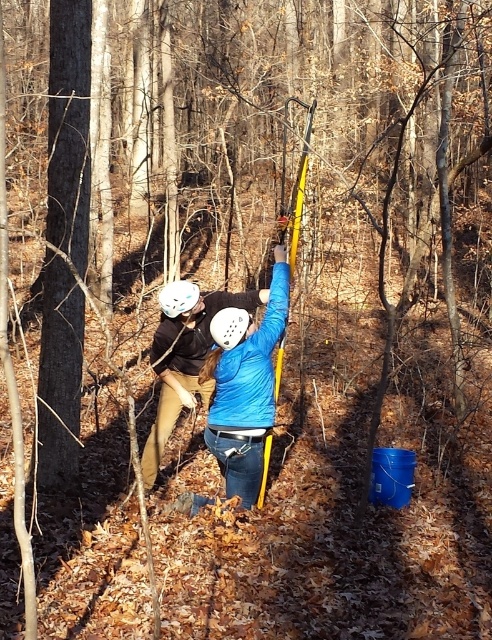
Question: Which of the following is the farthest from the observer?

Choices:
 (A) (231, 406)
 (B) (187, 280)
 (C) (216, 339)

Answer: (B)

Question: Does blue matte jacket at center lie behind white matte helmet at upper center?

Choices:
 (A) no
 (B) yes

Answer: (A)

Question: Which of the following is the closest to the observer?

Choices:
 (A) blue matte jacket at center
 (B) white matte helmet at upper center
 (C) white matte helmet at center

Answer: (C)

Question: Is blue matte jacket at center behind white matte helmet at upper center?

Choices:
 (A) no
 (B) yes

Answer: (A)

Question: Which object is the farthest from the blue matte jacket at center?

Choices:
 (A) white matte helmet at center
 (B) white matte helmet at upper center

Answer: (B)

Question: Does white matte helmet at center have a smaller size compared to white matte helmet at upper center?

Choices:
 (A) yes
 (B) no

Answer: (B)